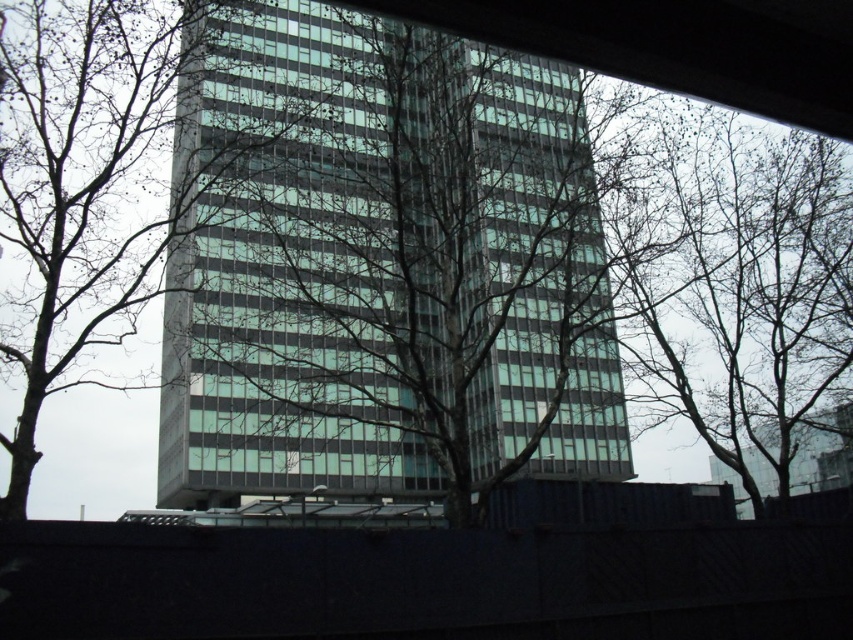
You are standing in front of a modern office building and notice the green glass building at center and the bare branches at upper center. Which object is nearer to you?

The green glass building at center is closer to the viewer than the bare branches at upper center.

In the scene shown: You are a drone operator trying to fly a drone between the green glass building at center and the bare branches at upper center. The drone has a maximum flight distance of 15 meters. Can the drone safely navigate this path without exceeding its range?

The green glass building at center is 16.96 meters from the bare branches at upper center. Since the drone can only fly up to 15 meters, it cannot safely navigate the path between them as the distance exceeds its maximum range.